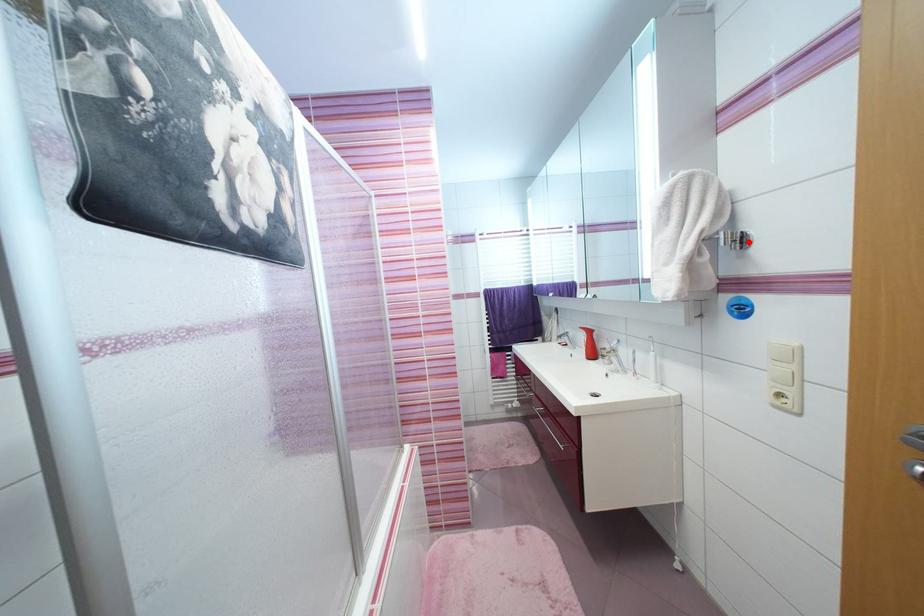
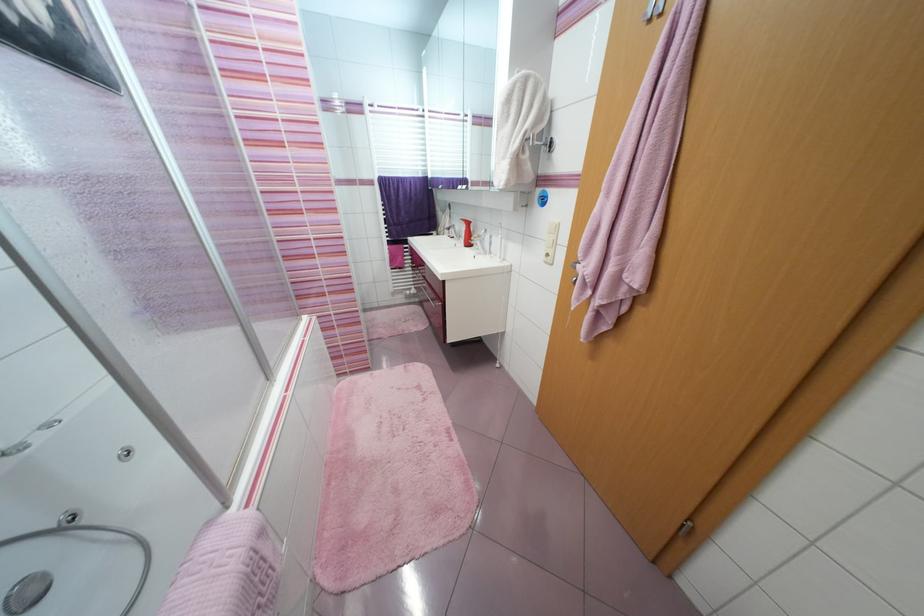
Find the pixel in the second image that matches the highlighted location in the first image.

(555, 147)